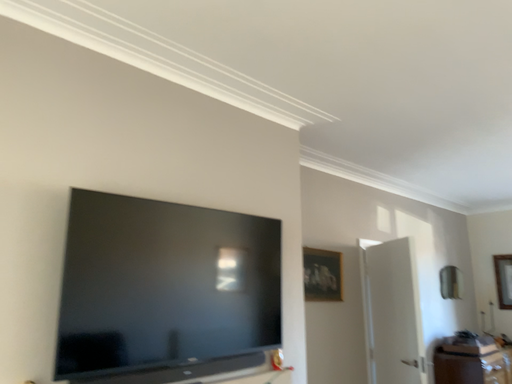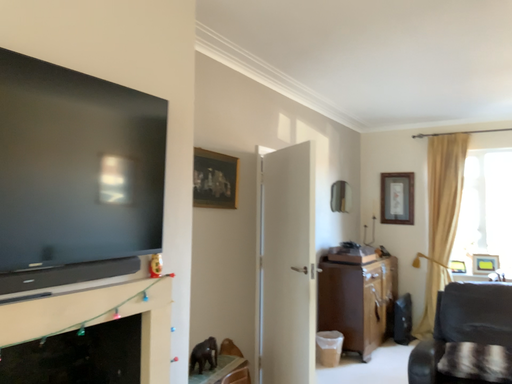
Question: How did the camera likely rotate when shooting the video?

Choices:
 (A) rotated left
 (B) rotated right

Answer: (B)